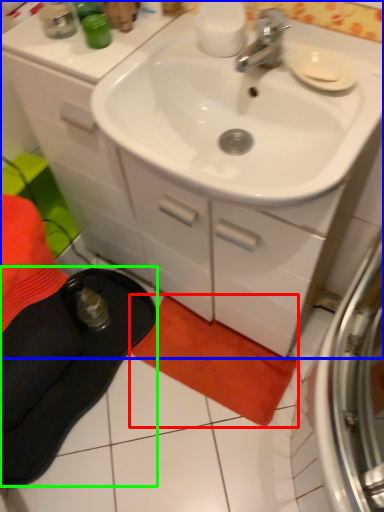
Question: Based on their relative distances, which object is nearer to beach towel (highlighted by a red box)? Choose from bathroom cabinet (highlighted by a blue box) and slipper (highlighted by a green box).

Choices:
 (A) bathroom cabinet
 (B) slipper

Answer: (B)